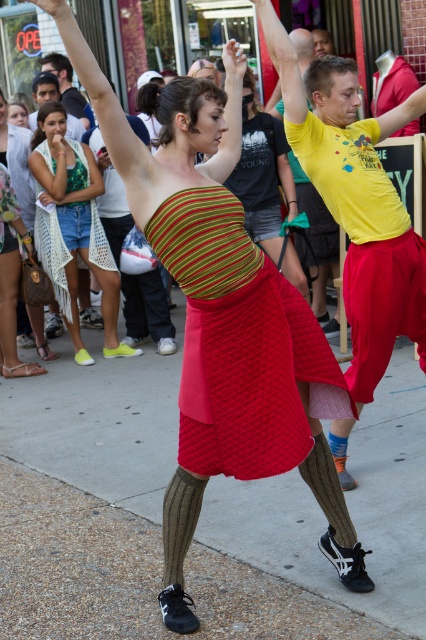
Locate an element on the screen. smooth concrete pavement at center is located at coordinates (348, 509).

Which is in front, point (129, 380) or point (270, 45)?

Point (270, 45) is more forward.

Does point (54, 412) come in front of point (388, 257)?

No, it is behind (388, 257).

In order to click on smooth concrete pavement at center in this screenshot , I will do `click(348, 509)`.

Between point (34, 172) and point (25, 157), which one is positioned in front?

Point (34, 172)

Can you confirm if knitted green and yellow top at center is taller than matte green dress at center?

Correct, knitted green and yellow top at center is much taller as matte green dress at center.

Identify the location of knitted green and yellow top at center. (72, 227).

At what (x,y) coordinates should I click in order to perform the action: click on knitted green and yellow top at center. Please return your answer as a coordinate pair (x, y). The height and width of the screenshot is (640, 426). Looking at the image, I should click on (72, 227).

At what (x,y) coordinates should I click in order to perform the action: click on quilted red dress at center. Please return your answer as a coordinate pair (x, y). This screenshot has height=640, width=426. Looking at the image, I should click on (238, 342).

Between point (187, 392) and point (109, 308), which one is positioned in front?

Point (187, 392) is more forward.

Is point (342, 403) positioned in front of point (62, 179)?

Yes, point (342, 403) is in front of point (62, 179).

Where is `quilted red dress at center`? The height and width of the screenshot is (640, 426). quilted red dress at center is located at coordinates (238, 342).